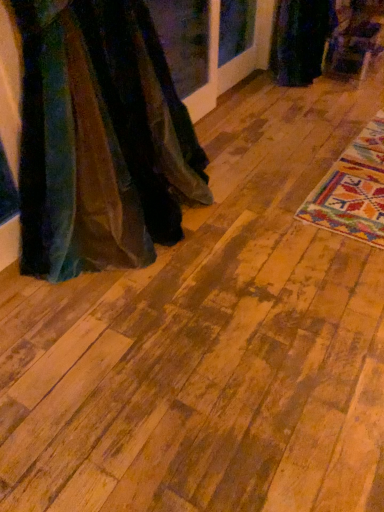
You are a GUI agent. You are given a task and a screenshot of the screen. Output one action in this format:
    pyautogui.click(x=<x>, y=<y>)
    Task: Click on the vacant area that is situated to the right of velvet fabric dress at left, placed as the 1th fancy dress when sorted from left to right
    
    Given the screenshot: What is the action you would take?
    pyautogui.click(x=225, y=262)